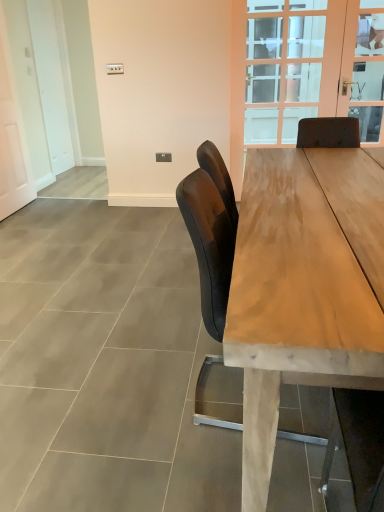
Question: From a real-world perspective, is clear glass door at upper center above or below clear glass door at upper right?

Choices:
 (A) above
 (B) below

Answer: (B)

Question: Does point (377, 141) appear closer or farther from the camera than point (367, 56)?

Choices:
 (A) farther
 (B) closer

Answer: (B)

Question: Which object is the closest to the matte black chair at center?

Choices:
 (A) wooden table at center
 (B) white matte door at left
 (C) clear glass door at upper center
 (D) clear glass door at upper right

Answer: (A)

Question: Which object is positioned closest to the clear glass door at upper right?

Choices:
 (A) wooden table at center
 (B) matte black chair at center
 (C) white matte door at left
 (D) clear glass door at upper center

Answer: (D)